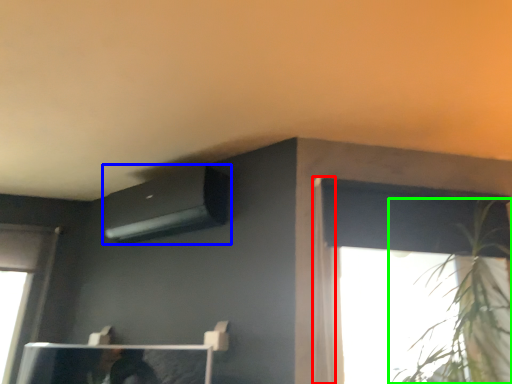
Question: Which object is positioned closest to curtain (highlighted by a red box)? Select from air conditioning (highlighted by a blue box) and houseplant (highlighted by a green box).

Choices:
 (A) air conditioning
 (B) houseplant

Answer: (B)